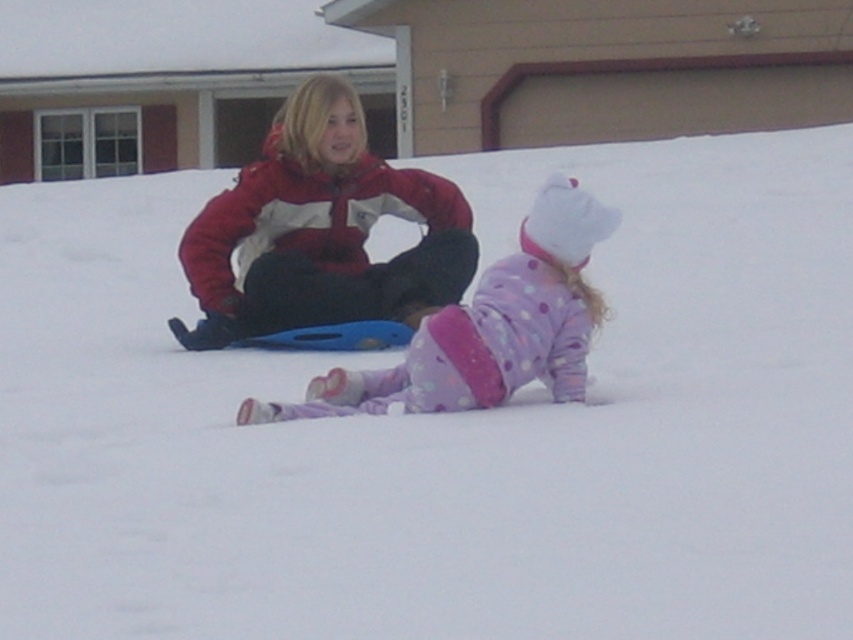
Question: Which of the following is the closest to the observer?

Choices:
 (A) red jacket at center
 (B) polka dot fleece pants at center

Answer: (B)

Question: Which object is farther from the camera taking this photo?

Choices:
 (A) red jacket at center
 (B) polka dot fleece pants at center

Answer: (A)

Question: Where is red jacket at center located in relation to polka dot fleece pants at center in the image?

Choices:
 (A) above
 (B) below

Answer: (A)

Question: Is red jacket at center to the right of polka dot fleece pants at center from the viewer's perspective?

Choices:
 (A) no
 (B) yes

Answer: (A)

Question: From the image, what is the correct spatial relationship of red jacket at center in relation to polka dot fleece pants at center?

Choices:
 (A) below
 (B) above

Answer: (B)

Question: Which point is farther to the camera?

Choices:
 (A) (338, 113)
 (B) (517, 262)

Answer: (A)